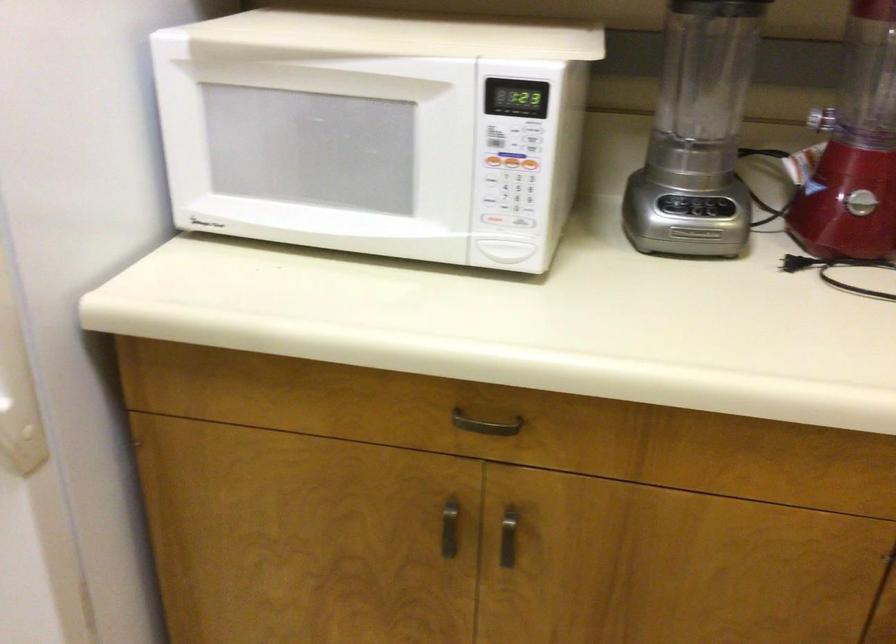
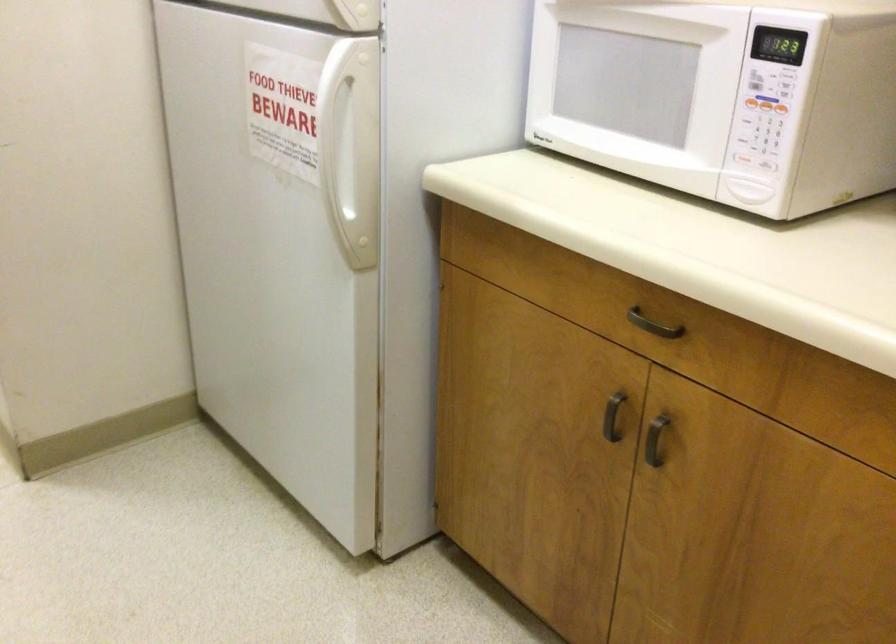
Locate, in the second image, the point that corresponds to point 452,536 in the first image.

(613, 417)